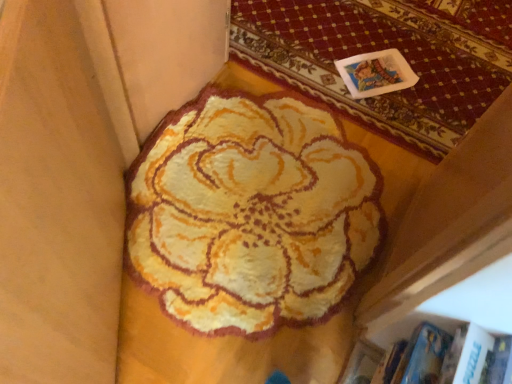
The height and width of the screenshot is (384, 512). Describe the element at coordinates (251, 214) in the screenshot. I see `fluffy yellow rug at center` at that location.

Locate an element on the screen. fluffy yellow rug at center is located at coordinates (251, 214).

Measure the distance between fluffy yellow rug at upper center and camera.

fluffy yellow rug at upper center is 1.56 meters away from camera.

Identify the location of fluffy yellow rug at upper center. (383, 49).

This screenshot has height=384, width=512. Describe the element at coordinates (383, 49) in the screenshot. I see `fluffy yellow rug at upper center` at that location.

You are a GUI agent. You are given a task and a screenshot of the screen. Output one action in this format:
    pyautogui.click(x=<x>, y=<y>)
    Task: Click on the fluffy yellow rug at center
    This screenshot has height=384, width=512.
    Given the screenshot: What is the action you would take?
    pyautogui.click(x=251, y=214)

Does fluffy yellow rug at center appear on the left side of fluffy yellow rug at upper center?

Yes, fluffy yellow rug at center is to the left of fluffy yellow rug at upper center.

Considering their positions, is fluffy yellow rug at center located in front of or behind fluffy yellow rug at upper center?

fluffy yellow rug at center is positioned closer to the viewer than fluffy yellow rug at upper center.

Is point (246, 329) positioned after point (384, 31)?

No, (246, 329) is closer to viewer.

From the image's perspective, is fluffy yellow rug at center over fluffy yellow rug at upper center?

No, from the image's perspective, fluffy yellow rug at center is not over fluffy yellow rug at upper center.

From a real-world perspective, is fluffy yellow rug at center below fluffy yellow rug at upper center?

No, from a real-world perspective, fluffy yellow rug at center is not below fluffy yellow rug at upper center.

Is fluffy yellow rug at center wider or thinner than fluffy yellow rug at upper center?

Clearly, fluffy yellow rug at center has more width compared to fluffy yellow rug at upper center.

Is fluffy yellow rug at center taller or shorter than fluffy yellow rug at upper center?

In the image, fluffy yellow rug at center appears to be taller than fluffy yellow rug at upper center.

Considering the sizes of objects fluffy yellow rug at center and fluffy yellow rug at upper center in the image provided, who is bigger, fluffy yellow rug at center or fluffy yellow rug at upper center?

fluffy yellow rug at center.

Is fluffy yellow rug at center inside or outside of fluffy yellow rug at upper center?

fluffy yellow rug at center is not inside fluffy yellow rug at upper center, it's outside.

Is fluffy yellow rug at center placed right next to fluffy yellow rug at upper center?

fluffy yellow rug at center and fluffy yellow rug at upper center are clearly separated.

Is fluffy yellow rug at center facing away from fluffy yellow rug at upper center?

Yes, fluffy yellow rug at center is facing away from fluffy yellow rug at upper center.

The width and height of the screenshot is (512, 384). I want to click on flower below the fluffy yellow rug at upper center (from the image's perspective), so click(x=251, y=214).

Considering the relative positions of fluffy yellow rug at upper center and fluffy yellow rug at center in the image provided, is fluffy yellow rug at upper center to the right of fluffy yellow rug at center from the viewer's perspective?

Correct, you'll find fluffy yellow rug at upper center to the right of fluffy yellow rug at center.

Is fluffy yellow rug at upper center positioned behind fluffy yellow rug at center?

Yes, it is.

Between point (418, 98) and point (206, 276), which one is positioned behind?

Positioned behind is point (418, 98).

From the image's perspective, between fluffy yellow rug at upper center and fluffy yellow rug at center, which one is located above?

From the image's view, fluffy yellow rug at upper center is above.

From a real-world perspective, between fluffy yellow rug at upper center and fluffy yellow rug at center, who is vertically higher?

In real-world perspective, fluffy yellow rug at center is above.

Which of these two, fluffy yellow rug at upper center or fluffy yellow rug at center, is thinner?

fluffy yellow rug at upper center is thinner.

Considering the sizes of objects fluffy yellow rug at upper center and fluffy yellow rug at center in the image provided, who is shorter, fluffy yellow rug at upper center or fluffy yellow rug at center?

With less height is fluffy yellow rug at upper center.

Who is smaller, fluffy yellow rug at upper center or fluffy yellow rug at center?

fluffy yellow rug at upper center is smaller.

Is fluffy yellow rug at center surrounded by fluffy yellow rug at upper center?

Definitely not — fluffy yellow rug at center is not inside fluffy yellow rug at upper center.

Would you say fluffy yellow rug at upper center is a long distance from fluffy yellow rug at center?

Actually, fluffy yellow rug at upper center and fluffy yellow rug at center are a little close together.

Is fluffy yellow rug at upper center looking in the opposite direction of fluffy yellow rug at center?

No, fluffy yellow rug at center is not at the back of fluffy yellow rug at upper center.

How different are the orientations of fluffy yellow rug at upper center and fluffy yellow rug at center in degrees?

1.7 degrees separate the facing orientations of fluffy yellow rug at upper center and fluffy yellow rug at center.

Measure the distance from fluffy yellow rug at upper center to fluffy yellow rug at center.

The distance of fluffy yellow rug at upper center from fluffy yellow rug at center is 23.64 inches.

At what (x,y) coordinates should I click in order to perform the action: click on mat behind the fluffy yellow rug at center. Please return your answer as a coordinate pair (x, y). The image size is (512, 384). Looking at the image, I should click on (383, 49).

There is a fluffy yellow rug at upper center. Identify the location of flower above it (from a real-world perspective). The height and width of the screenshot is (384, 512). (251, 214).

What are the coordinates of `mat that is above the fluffy yellow rug at center (from the image's perspective)` in the screenshot? It's located at pyautogui.click(x=383, y=49).